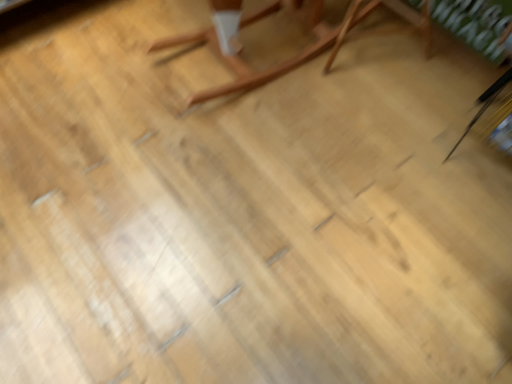
Where is `free spot to the right of light brown wood rocking chair at center`? free spot to the right of light brown wood rocking chair at center is located at coordinates (384, 104).